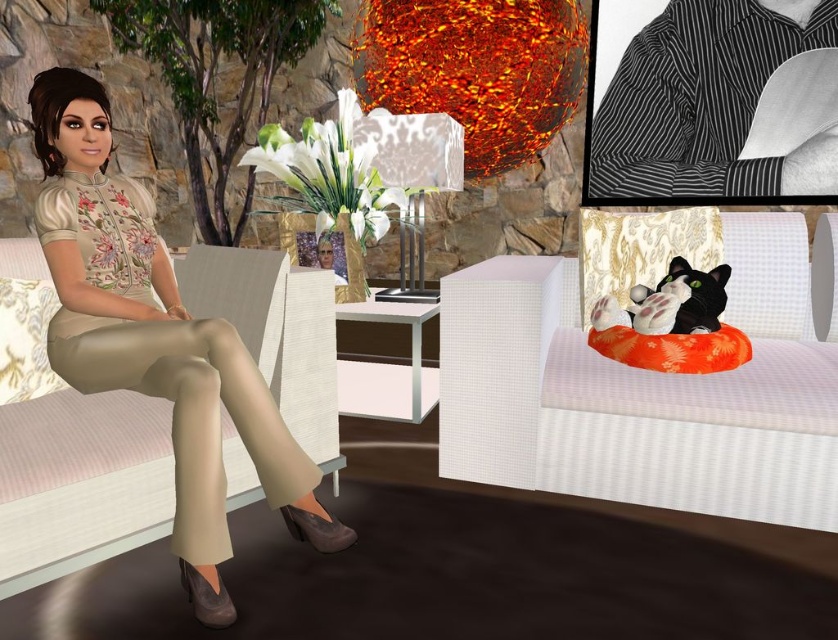
Describe the element at coordinates (643, 392) in the screenshot. I see `orange fabric couch at right` at that location.

Which is below, orange fabric couch at right or beige fabric pants at left?

orange fabric couch at right is lower down.

Identify the location of orange fabric couch at right. Image resolution: width=838 pixels, height=640 pixels. (643, 392).

Between point (110, 115) and point (711, 60), which one is positioned behind?

Positioned behind is point (711, 60).

Describe the element at coordinates (156, 340) in the screenshot. Image resolution: width=838 pixels, height=640 pixels. I see `beige fabric pants at left` at that location.

Is point (112, 259) farther from camera compared to point (720, 97)?

No, it is in front of (720, 97).

Locate an element on the screen. Image resolution: width=838 pixels, height=640 pixels. beige fabric pants at left is located at coordinates (156, 340).

Which of these two, orange fabric couch at right or striped fabric shirt at upper right, stands shorter?

Standing shorter between the two is orange fabric couch at right.

Is orange fabric couch at right to the left of striped fabric shirt at upper right from the viewer's perspective?

Correct, you'll find orange fabric couch at right to the left of striped fabric shirt at upper right.

You are a GUI agent. You are given a task and a screenshot of the screen. Output one action in this format:
    pyautogui.click(x=<x>, y=<y>)
    Task: Click on the orange fabric couch at right
    Image resolution: width=838 pixels, height=640 pixels.
    Given the screenshot: What is the action you would take?
    pyautogui.click(x=643, y=392)

The image size is (838, 640). What are the coordinates of `orange fabric couch at right` in the screenshot? It's located at (643, 392).